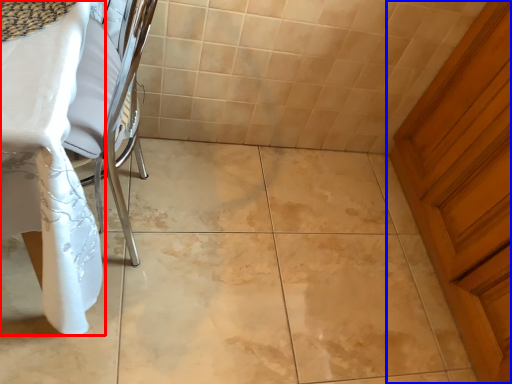
Question: Among these objects, which one is farthest to the camera, table (highlighted by a red box) or door (highlighted by a blue box)?

Choices:
 (A) table
 (B) door

Answer: (B)